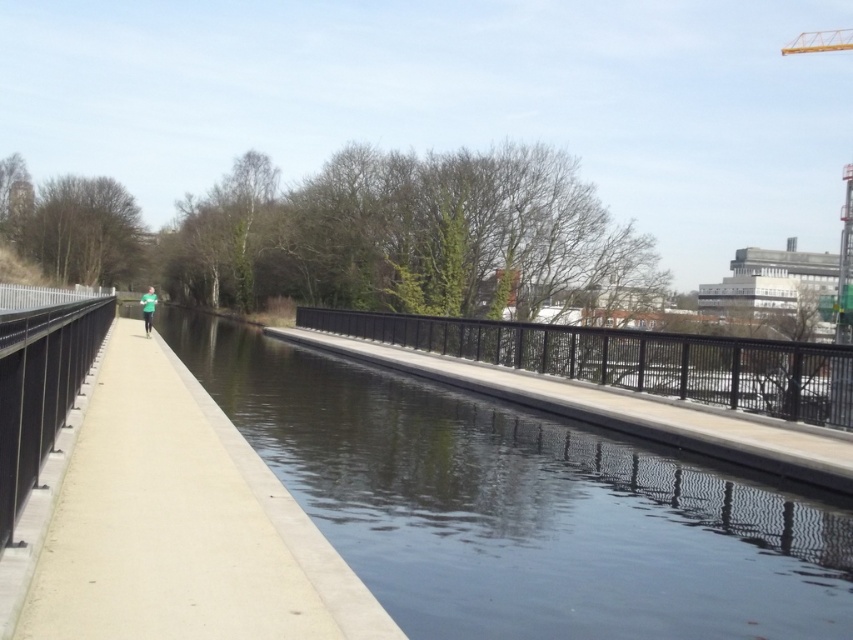
Question: Is smooth concrete river at center above concrete sidewalk at center?

Choices:
 (A) yes
 (B) no

Answer: (B)

Question: Does concrete sidewalk at center appear on the right side of black metal rail at center?

Choices:
 (A) no
 (B) yes

Answer: (A)

Question: Which object appears farthest from the camera in this image?

Choices:
 (A) smooth concrete river at center
 (B) concrete sidewalk at center

Answer: (A)

Question: Which object appears closest to the camera in this image?

Choices:
 (A) smooth concrete river at center
 (B) black metal rail at center
 (C) concrete sidewalk at center

Answer: (C)

Question: Estimate the real-world distances between objects in this image. Which object is farther from the smooth concrete river at center?

Choices:
 (A) black metal rail at center
 (B) concrete sidewalk at center

Answer: (A)

Question: Is smooth concrete river at center thinner than concrete sidewalk at center?

Choices:
 (A) no
 (B) yes

Answer: (A)